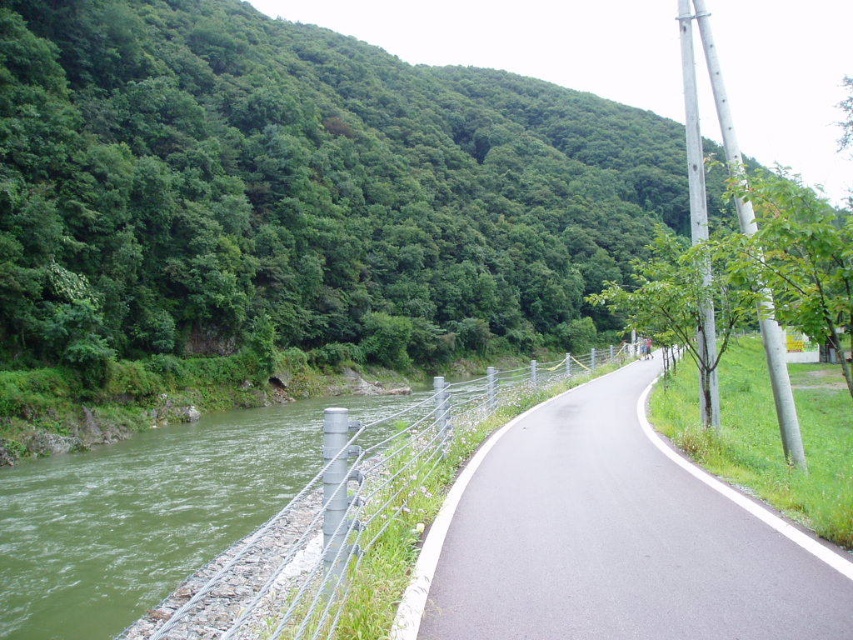
Question: Does green gravel river at left appear on the right side of wire mesh fence at left?

Choices:
 (A) no
 (B) yes

Answer: (A)

Question: Which point is farther to the camera?

Choices:
 (A) green leafy hillside at upper left
 (B) green gravel river at left
 (C) black asphalt road at center

Answer: (A)

Question: Which of the following is the closest to the observer?

Choices:
 (A) (33, 493)
 (B) (669, 532)
 (C) (384, 257)
 (D) (338, 605)

Answer: (D)

Question: Is green gravel river at left above wire mesh fence at left?

Choices:
 (A) yes
 (B) no

Answer: (B)

Question: Which point is closer to the camera?

Choices:
 (A) (302, 536)
 (B) (57, 262)
 (C) (245, 516)

Answer: (A)

Question: Is green leafy hillside at upper left in front of wire mesh fence at left?

Choices:
 (A) yes
 (B) no

Answer: (B)